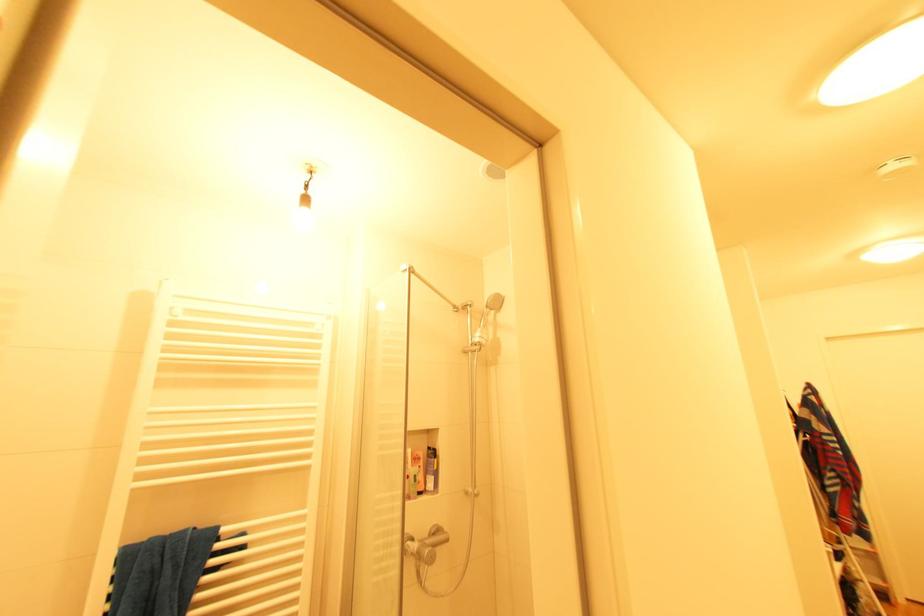
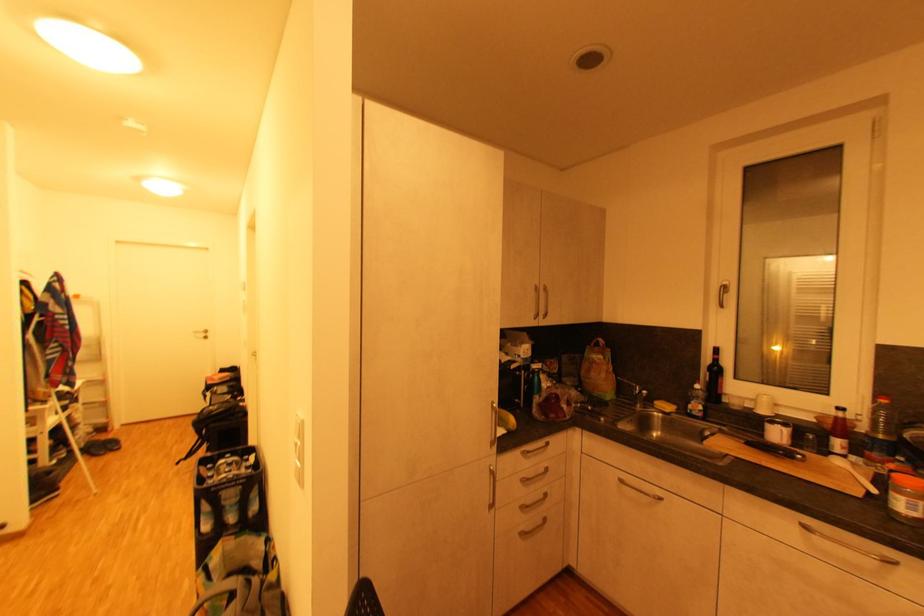
Question: The camera is either moving clockwise (left) or counter-clockwise (right) around the object. The first image is from the beginning of the video and the second image is from the end. Is the camera moving left or right when shooting the video?

Choices:
 (A) Left
 (B) Right

Answer: (A)